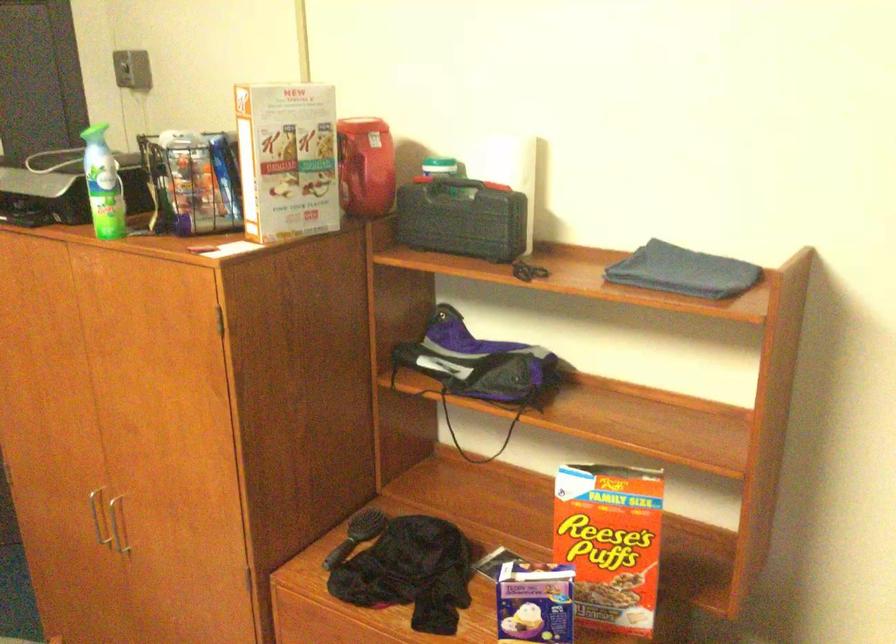
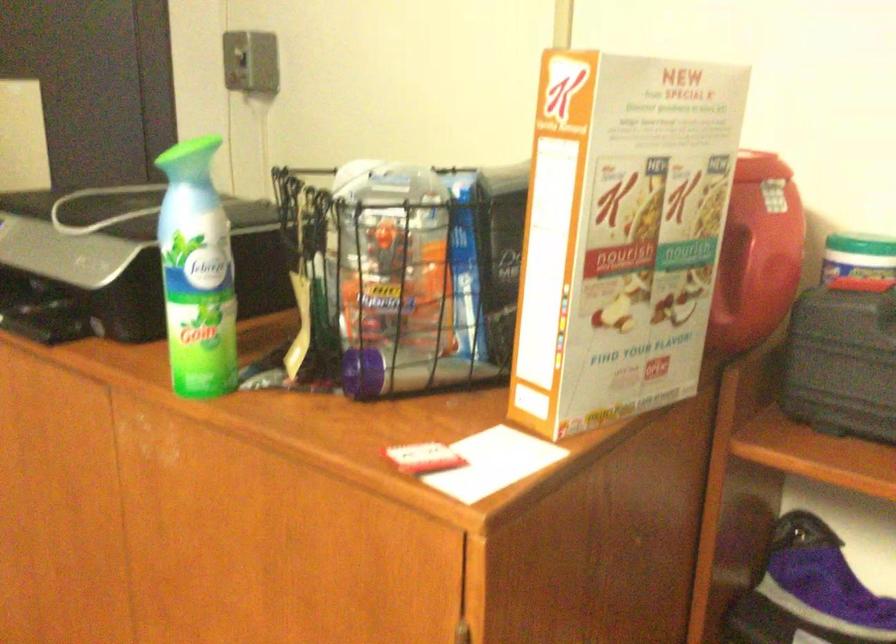
Question: I am providing you with two images of the same scene from different viewpoints. Please identify which objects are invisible in image2.

Choices:
 (A) scanner lid
 (B) black wire basket
 (C) red container handle
 (D) none of these

Answer: (D)